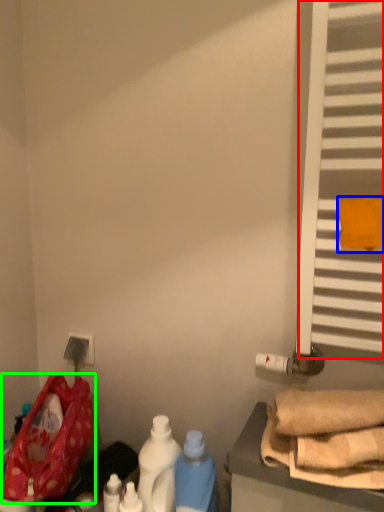
Question: Which object is positioned farthest from window (highlighted by a red box)? Select from beach towel (highlighted by a blue box) and wide (highlighted by a green box).

Choices:
 (A) beach towel
 (B) wide

Answer: (B)